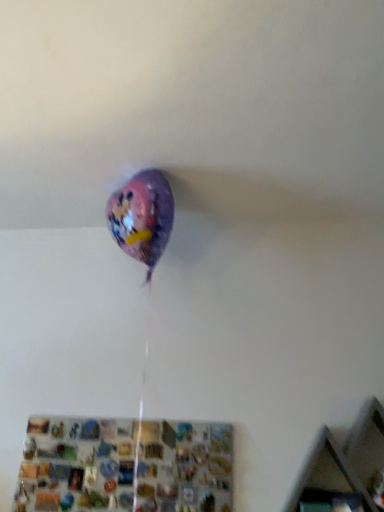
Where is `metallic mosaic shelf at lower center, which is the 1th shelf in left-to-right order`? metallic mosaic shelf at lower center, which is the 1th shelf in left-to-right order is located at coordinates (125, 466).

What do you see at coordinates (125, 466) in the screenshot? The width and height of the screenshot is (384, 512). I see `metallic mosaic shelf at lower center, which appears as the 2th shelf when viewed from the right` at bounding box center [125, 466].

At what (x,y) coordinates should I click in order to perform the action: click on wooden at upper right, which is counted as the 2th shelf, starting from the left. Please return your answer as a coordinate pair (x, y). Looking at the image, I should click on (328, 480).

The width and height of the screenshot is (384, 512). Describe the element at coordinates (328, 480) in the screenshot. I see `wooden at upper right, arranged as the 1th shelf when viewed from the right` at that location.

In order to face wooden at upper right, which is counted as the 2th shelf, starting from the left, should I rotate leftwards or rightwards?

A 17.936 degree turn to the right will do.

Locate an element on the screen. This screenshot has width=384, height=512. metallic mosaic shelf at lower center, which appears as the 2th shelf when viewed from the right is located at coordinates (125, 466).

Is metallic mosaic shelf at lower center, which appears as the 2th shelf when viewed from the right, at the right side of wooden at upper right, which is counted as the 2th shelf, starting from the left?

Incorrect, metallic mosaic shelf at lower center, which appears as the 2th shelf when viewed from the right, is not on the right side of wooden at upper right, which is counted as the 2th shelf, starting from the left.

In the image, is metallic mosaic shelf at lower center, which is the 1th shelf in left-to-right order, positioned in front of or behind wooden at upper right, arranged as the 1th shelf when viewed from the right?

In the image, metallic mosaic shelf at lower center, which is the 1th shelf in left-to-right order, appears behind wooden at upper right, arranged as the 1th shelf when viewed from the right.

Is point (104, 437) more distant than point (325, 490)?

Yes, point (104, 437) is behind point (325, 490).

From the image's perspective, which one is positioned lower, metallic mosaic shelf at lower center, which appears as the 2th shelf when viewed from the right, or wooden at upper right, arranged as the 1th shelf when viewed from the right?

metallic mosaic shelf at lower center, which appears as the 2th shelf when viewed from the right, from the image's perspective.

From a real-world perspective, is metallic mosaic shelf at lower center, which appears as the 2th shelf when viewed from the right, located beneath wooden at upper right, arranged as the 1th shelf when viewed from the right?

Indeed, from a real-world perspective, metallic mosaic shelf at lower center, which appears as the 2th shelf when viewed from the right, is positioned beneath wooden at upper right, arranged as the 1th shelf when viewed from the right.

In terms of width, does metallic mosaic shelf at lower center, which is the 1th shelf in left-to-right order, look wider or thinner when compared to wooden at upper right, which is counted as the 2th shelf, starting from the left?

metallic mosaic shelf at lower center, which is the 1th shelf in left-to-right order, is thinner than wooden at upper right, which is counted as the 2th shelf, starting from the left.

Considering the relative sizes of metallic mosaic shelf at lower center, which is the 1th shelf in left-to-right order, and wooden at upper right, arranged as the 1th shelf when viewed from the right, in the image provided, is metallic mosaic shelf at lower center, which is the 1th shelf in left-to-right order, shorter than wooden at upper right, arranged as the 1th shelf when viewed from the right,?

Yes.

Considering the sizes of metallic mosaic shelf at lower center, which appears as the 2th shelf when viewed from the right, and wooden at upper right, arranged as the 1th shelf when viewed from the right, in the image, is metallic mosaic shelf at lower center, which appears as the 2th shelf when viewed from the right, bigger or smaller than wooden at upper right, arranged as the 1th shelf when viewed from the right,?

In the image, metallic mosaic shelf at lower center, which appears as the 2th shelf when viewed from the right, appears to be smaller than wooden at upper right, arranged as the 1th shelf when viewed from the right.

Can wooden at upper right, arranged as the 1th shelf when viewed from the right, be found inside metallic mosaic shelf at lower center, which appears as the 2th shelf when viewed from the right?

No, wooden at upper right, arranged as the 1th shelf when viewed from the right, is not a part of metallic mosaic shelf at lower center, which appears as the 2th shelf when viewed from the right.

Is metallic mosaic shelf at lower center, which is the 1th shelf in left-to-right order, looking in the opposite direction of wooden at upper right, which is counted as the 2th shelf, starting from the left?

No.

Consider the image. How different are the orientations of metallic mosaic shelf at lower center, which is the 1th shelf in left-to-right order, and wooden at upper right, which is counted as the 2th shelf, starting from the left, in degrees?

The facing directions of metallic mosaic shelf at lower center, which is the 1th shelf in left-to-right order, and wooden at upper right, which is counted as the 2th shelf, starting from the left, are 0.00364 degrees apart.

Locate an element on the screen. The image size is (384, 512). shelf below the wooden at upper right, arranged as the 1th shelf when viewed from the right (from a real-world perspective) is located at coordinates (125, 466).

Is wooden at upper right, arranged as the 1th shelf when viewed from the right, at the left side of metallic mosaic shelf at lower center, which appears as the 2th shelf when viewed from the right?

No.

Is wooden at upper right, arranged as the 1th shelf when viewed from the right, positioned before metallic mosaic shelf at lower center, which is the 1th shelf in left-to-right order?

Yes, it is in front of metallic mosaic shelf at lower center, which is the 1th shelf in left-to-right order.

Is point (327, 464) positioned after point (189, 464)?

No, it is in front of (189, 464).

From the image's perspective, is wooden at upper right, arranged as the 1th shelf when viewed from the right, over metallic mosaic shelf at lower center, which appears as the 2th shelf when viewed from the right?

Yes, from the image's perspective, wooden at upper right, arranged as the 1th shelf when viewed from the right, is above metallic mosaic shelf at lower center, which appears as the 2th shelf when viewed from the right.

From a real-world perspective, is wooden at upper right, which is counted as the 2th shelf, starting from the left, positioned under metallic mosaic shelf at lower center, which is the 1th shelf in left-to-right order, based on gravity?

No.

Is wooden at upper right, arranged as the 1th shelf when viewed from the right, wider than metallic mosaic shelf at lower center, which is the 1th shelf in left-to-right order?

Indeed, wooden at upper right, arranged as the 1th shelf when viewed from the right, has a greater width compared to metallic mosaic shelf at lower center, which is the 1th shelf in left-to-right order.

In the scene shown: Does wooden at upper right, arranged as the 1th shelf when viewed from the right, have a greater height compared to metallic mosaic shelf at lower center, which appears as the 2th shelf when viewed from the right?

Correct, wooden at upper right, arranged as the 1th shelf when viewed from the right, is much taller as metallic mosaic shelf at lower center, which appears as the 2th shelf when viewed from the right.

Between wooden at upper right, which is counted as the 2th shelf, starting from the left, and metallic mosaic shelf at lower center, which appears as the 2th shelf when viewed from the right, which one has smaller size?

Smaller between the two is metallic mosaic shelf at lower center, which appears as the 2th shelf when viewed from the right.

Is wooden at upper right, which is counted as the 2th shelf, starting from the left, positioned beyond the bounds of metallic mosaic shelf at lower center, which is the 1th shelf in left-to-right order?

Yes, wooden at upper right, which is counted as the 2th shelf, starting from the left, is located beyond the bounds of metallic mosaic shelf at lower center, which is the 1th shelf in left-to-right order.

Is the surface of wooden at upper right, which is counted as the 2th shelf, starting from the left, in direct contact with metallic mosaic shelf at lower center, which is the 1th shelf in left-to-right order?

No, wooden at upper right, which is counted as the 2th shelf, starting from the left, is not touching metallic mosaic shelf at lower center, which is the 1th shelf in left-to-right order.

From the picture: Is wooden at upper right, arranged as the 1th shelf when viewed from the right, aimed at metallic mosaic shelf at lower center, which appears as the 2th shelf when viewed from the right?

No, wooden at upper right, arranged as the 1th shelf when viewed from the right, is not aimed at metallic mosaic shelf at lower center, which appears as the 2th shelf when viewed from the right.

How many degrees apart are the facing directions of wooden at upper right, arranged as the 1th shelf when viewed from the right, and metallic mosaic shelf at lower center, which is the 1th shelf in left-to-right order?

wooden at upper right, arranged as the 1th shelf when viewed from the right, and metallic mosaic shelf at lower center, which is the 1th shelf in left-to-right order, are facing 0.00364 degrees away from each other.

Where is `shelf above the metallic mosaic shelf at lower center, which appears as the 2th shelf when viewed from the right (from a real-world perspective)`? The image size is (384, 512). shelf above the metallic mosaic shelf at lower center, which appears as the 2th shelf when viewed from the right (from a real-world perspective) is located at coordinates (328, 480).

At what (x,y) coordinates should I click in order to perform the action: click on shelf on the right of metallic mosaic shelf at lower center, which appears as the 2th shelf when viewed from the right. Please return your answer as a coordinate pair (x, y). This screenshot has width=384, height=512. Looking at the image, I should click on (328, 480).

Locate an element on the screen. shelf directly beneath the wooden at upper right, which is counted as the 2th shelf, starting from the left (from a real-world perspective) is located at coordinates (125, 466).